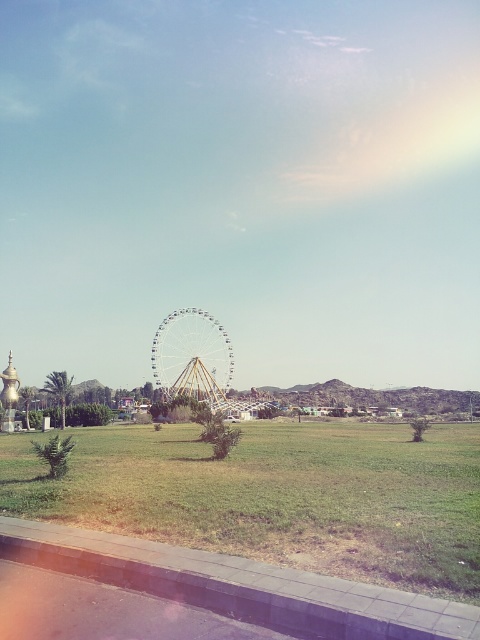
Question: Which object is farther from the camera taking this photo?

Choices:
 (A) green grassy field at center
 (B) white metallic ferris wheel at center

Answer: (B)

Question: Observing the image, what is the correct spatial positioning of green grassy field at center in reference to white metallic ferris wheel at center?

Choices:
 (A) above
 (B) below

Answer: (A)

Question: From the image, what is the correct spatial relationship of green grassy field at center in relation to white metallic ferris wheel at center?

Choices:
 (A) left
 (B) right

Answer: (B)

Question: Where is green grassy field at center located in relation to white metallic ferris wheel at center in the image?

Choices:
 (A) right
 (B) left

Answer: (A)